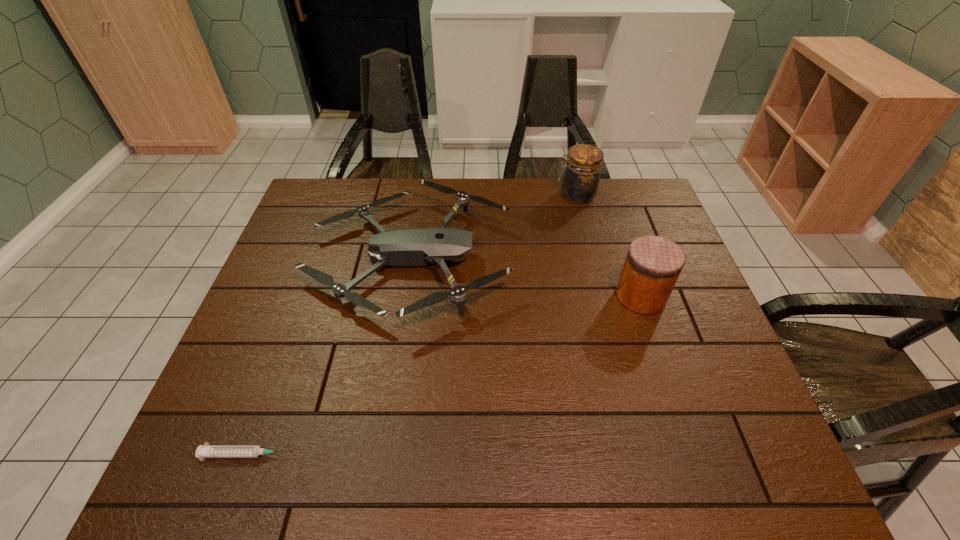
This screenshot has width=960, height=540. In the image, there is a desktop. What are the coordinates of `vacant space at the near edge` in the screenshot? It's located at (328, 473).

Image resolution: width=960 pixels, height=540 pixels. Find the location of `vacant space at the left edge`. vacant space at the left edge is located at coordinates (315, 238).

The image size is (960, 540). In the image, there is a desktop. Identify the location of blank space at the right edge. (669, 341).

In the image, there is a desktop. Where is `free space at the far left corner`? free space at the far left corner is located at coordinates (299, 222).

I want to click on empty space between the nearest object and the farther jar, so click(x=411, y=325).

The width and height of the screenshot is (960, 540). I want to click on unoccupied position between the farther jar and the nearer jar, so click(609, 246).

Where is `free space between the farther jar and the drone`? The image size is (960, 540). free space between the farther jar and the drone is located at coordinates (492, 227).

Find the location of a particular element. The width and height of the screenshot is (960, 540). free spot between the drone and the farther jar is located at coordinates (492, 227).

You are a GUI agent. You are given a task and a screenshot of the screen. Output one action in this format:
    pyautogui.click(x=<x>, y=<y>)
    Task: Click on the free point between the farther jar and the syringe
    The height and width of the screenshot is (540, 960).
    Given the screenshot: What is the action you would take?
    pyautogui.click(x=411, y=325)

What are the coordinates of `vacant space that's between the second shortest object and the farther jar` in the screenshot? It's located at (492, 227).